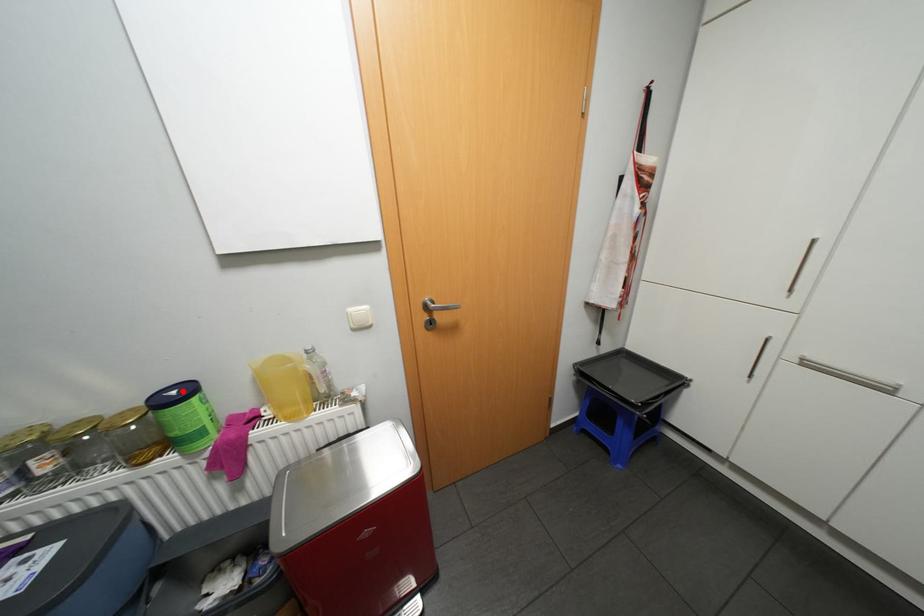
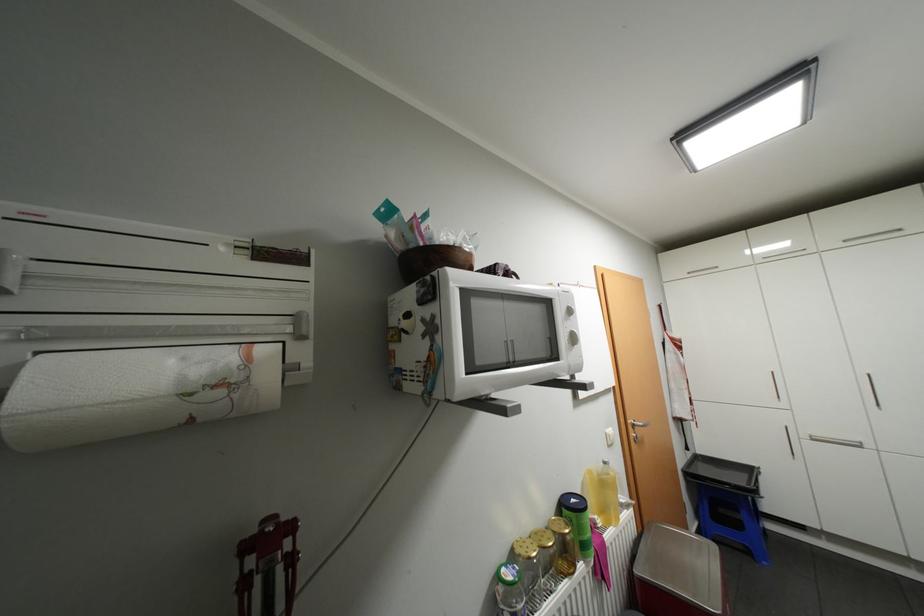
The point at the highlighted location is marked in the first image. Where is the corresponding point in the second image?

(580, 499)